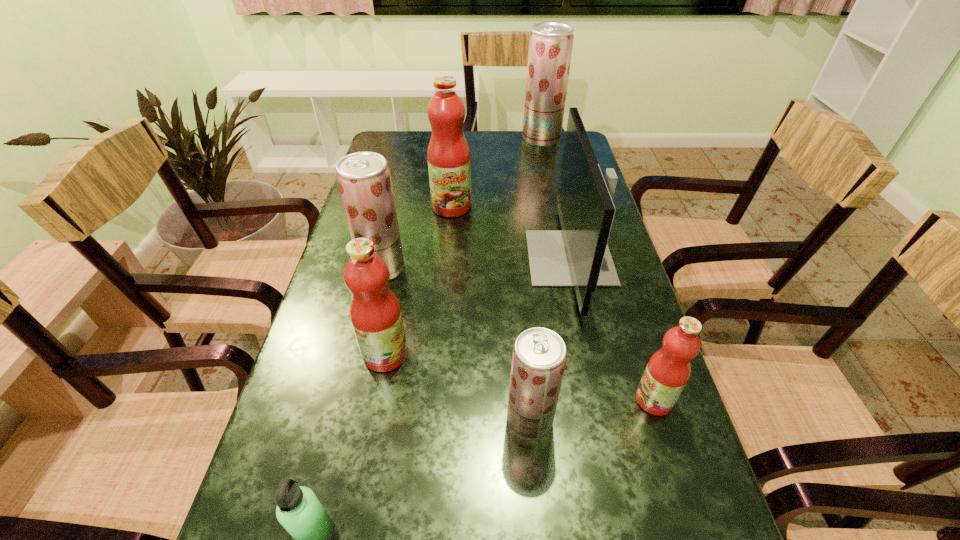
Where is `the second strawberry fruit juice from right to left`? the second strawberry fruit juice from right to left is located at coordinates (539, 355).

Locate an element on the screen. The image size is (960, 540). the rightmost fruit juice is located at coordinates (668, 370).

I want to click on the nearest pink fruit juice, so click(668, 370).

Where is `free region located on the left of the biggest strawberry fruit juice`? The height and width of the screenshot is (540, 960). free region located on the left of the biggest strawberry fruit juice is located at coordinates (417, 139).

The image size is (960, 540). In order to click on vacant space situated on the front label of the second pink fruit juice from right to left in this screenshot , I will do (x=445, y=281).

Where is `blank space located 0.210m on the screen of the computer monitor`? This screenshot has height=540, width=960. blank space located 0.210m on the screen of the computer monitor is located at coordinates (448, 258).

Identify the location of vacant space located 0.360m on the screen of the computer monitor. The width and height of the screenshot is (960, 540). (391, 258).

Locate an element on the screen. The height and width of the screenshot is (540, 960). vacant space positioned 0.230m on the screen of the computer monitor is located at coordinates (441, 258).

Locate an element on the screen. free space located on the back of the third farthest fruit juice is located at coordinates (404, 174).

You are a GUI agent. You are given a task and a screenshot of the screen. Output one action in this format:
    pyautogui.click(x=<x>, y=<y>)
    Task: Click on the free point located on the front label of the fifth farthest object
    The image size is (960, 540).
    Given the screenshot: What is the action you would take?
    pyautogui.click(x=516, y=354)